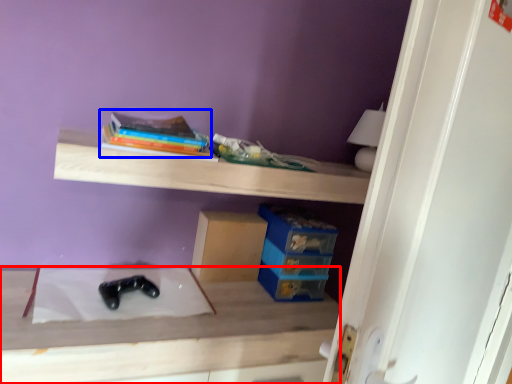
Question: Which object is further to the camera taking this photo, table (highlighted by a red box) or book (highlighted by a blue box)?

Choices:
 (A) table
 (B) book

Answer: (B)